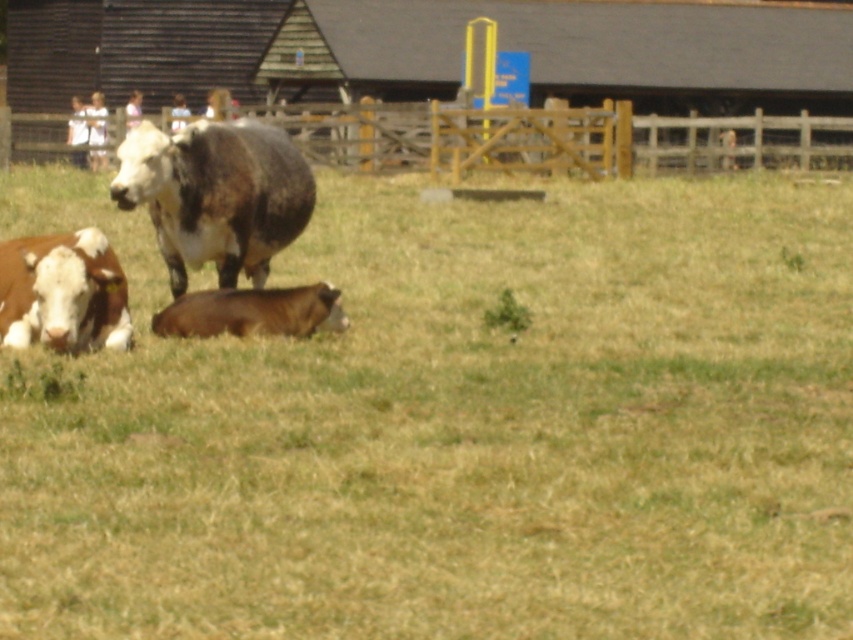
Question: Which point appears farthest from the camera in this image?

Choices:
 (A) click(335, 291)
 (B) click(436, 109)
 (C) click(187, 214)

Answer: (B)

Question: Is wooden fence at upper center thinner than brown speckled cow at lower left?

Choices:
 (A) no
 (B) yes

Answer: (A)

Question: Does wooden fence at upper center appear over brown speckled cow at lower left?

Choices:
 (A) no
 (B) yes

Answer: (B)

Question: Does brown shaggy bull at center appear under brown smooth cow at center?

Choices:
 (A) no
 (B) yes

Answer: (A)

Question: Which of the following is the farthest from the observer?

Choices:
 (A) brown grassy at lower left
 (B) brown shaggy bull at center

Answer: (B)

Question: Which of the following is the farthest from the observer?

Choices:
 (A) brown smooth cow at center
 (B) brown speckled cow at lower left
 (C) wooden fence at upper center

Answer: (C)